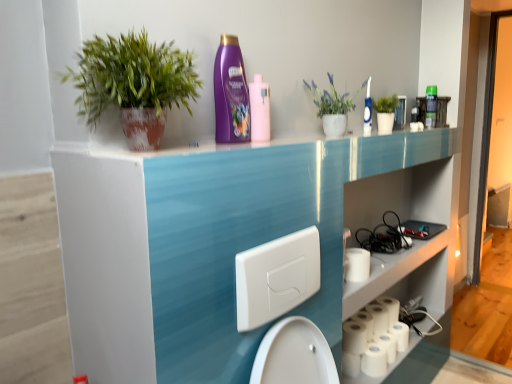
You are a GUI agent. You are given a task and a screenshot of the screen. Output one action in this format:
    pyautogui.click(x=<x>, y=<y>)
    Task: Click on the free point behind white matte paper towel at lower right
    
    Given the screenshot: What is the action you would take?
    pyautogui.click(x=368, y=261)